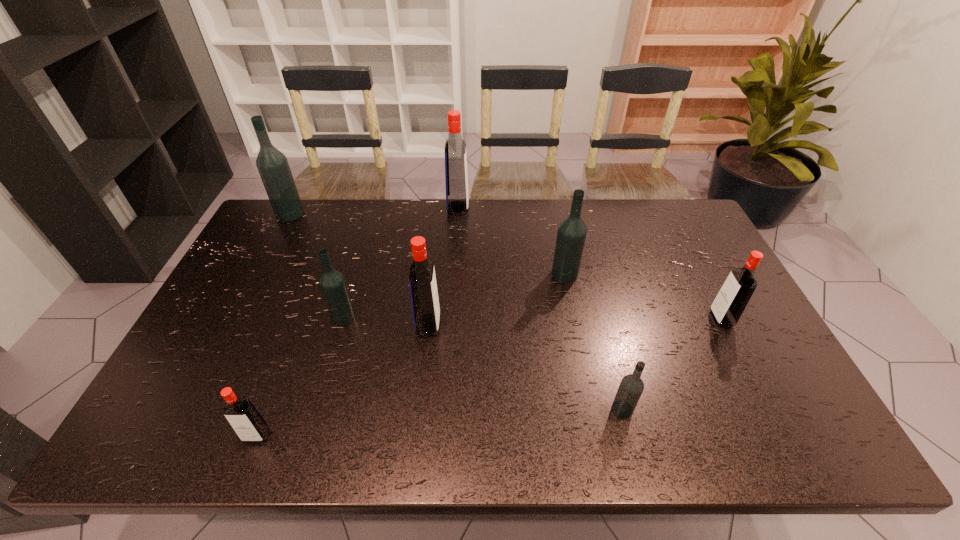
In the image, there is a desktop. Where is `free region at the far right corner`? This screenshot has width=960, height=540. free region at the far right corner is located at coordinates (661, 207).

In order to click on free space between the leftmost black vodka and the third black vodka from left to right in this screenshot , I will do `click(427, 244)`.

Identify the location of free space between the farthest red vodka and the second black vodka from left to right. This screenshot has height=540, width=960. (400, 262).

Identify the location of free spot between the sixth vodka from left to right and the second biggest red vodka. Image resolution: width=960 pixels, height=540 pixels. (496, 300).

Identify the location of free spot between the seventh object from right to left and the nearest black vodka. (440, 422).

Where is `empty space between the third smallest red vodka and the farthest red vodka`? Image resolution: width=960 pixels, height=540 pixels. empty space between the third smallest red vodka and the farthest red vodka is located at coordinates (443, 266).

I want to click on empty space between the nearest black vodka and the third smallest red vodka, so click(525, 367).

Identify the location of free spot between the farthest black vodka and the rightmost red vodka. Image resolution: width=960 pixels, height=540 pixels. (506, 266).

Find the location of a particular element. The image size is (960, 540). empty space that is in between the leftmost object and the second biggest black vodka is located at coordinates (427, 244).

Where is `free spot between the second object from right to left and the third object from left to right`? free spot between the second object from right to left and the third object from left to right is located at coordinates (483, 363).